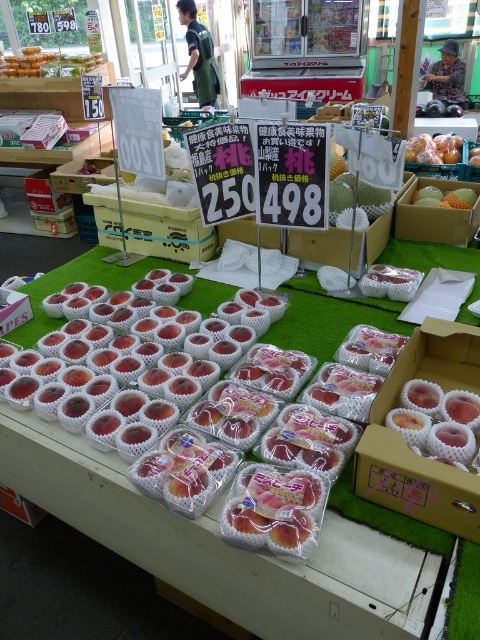
Who is higher up, translucent plastic peaches at center or translucent plastic box at center?

translucent plastic box at center is above.

Which is behind, point (446, 525) or point (407, 234)?

Positioned behind is point (407, 234).

What do you see at coordinates (404, 440) in the screenshot? The width and height of the screenshot is (480, 640). I see `translucent plastic peaches at center` at bounding box center [404, 440].

Where is `translucent plastic peaches at center`? This screenshot has width=480, height=640. translucent plastic peaches at center is located at coordinates (404, 440).

Does translucent plastic box at center lie behind shiny black ball at center?

No, it is not.

Consider the image. Who is more distant from viewer, (415, 230) or (441, 102)?

Point (441, 102)

You are a GUI agent. You are given a task and a screenshot of the screen. Output one action in this format:
    pyautogui.click(x=<x>, y=<y>)
    Task: Click on the translucent plastic box at center
    The height and width of the screenshot is (640, 480).
    Given the screenshot: What is the action you would take?
    pyautogui.click(x=435, y=216)

Between translucent plastic peaches at center and shiny black ball at center, which one is positioned lower?

translucent plastic peaches at center

Is point (382, 460) closer to camera compared to point (416, 115)?

That is True.

Locate an element on the screen. Image resolution: width=480 pixels, height=640 pixels. translucent plastic peaches at center is located at coordinates (404, 440).